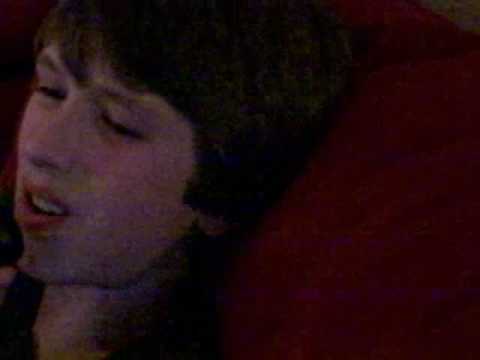
At what (x,y) coordinates should I click in order to perform the action: click on cushion. Please return your answer as a coordinate pair (x, y). This screenshot has height=360, width=480. Looking at the image, I should click on (430, 211), (398, 37).